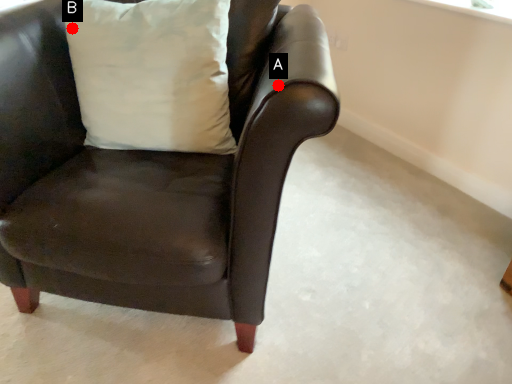
Question: Two points are circled on the image, labeled by A and B beside each circle. Which point is closer to the camera taking this photo?

Choices:
 (A) A is closer
 (B) B is closer

Answer: (A)